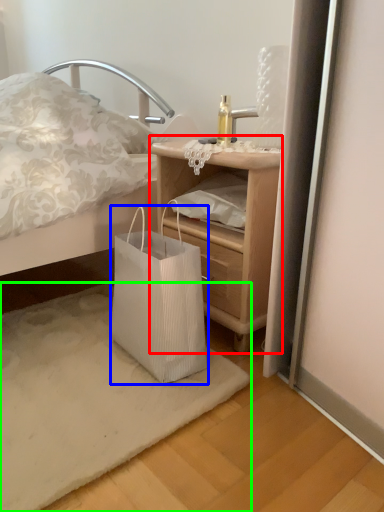
Question: Which object is the closest to the nightstand (highlighted by a red box)? Choose among these: bag (highlighted by a blue box) or mat (highlighted by a green box).

Choices:
 (A) bag
 (B) mat

Answer: (A)